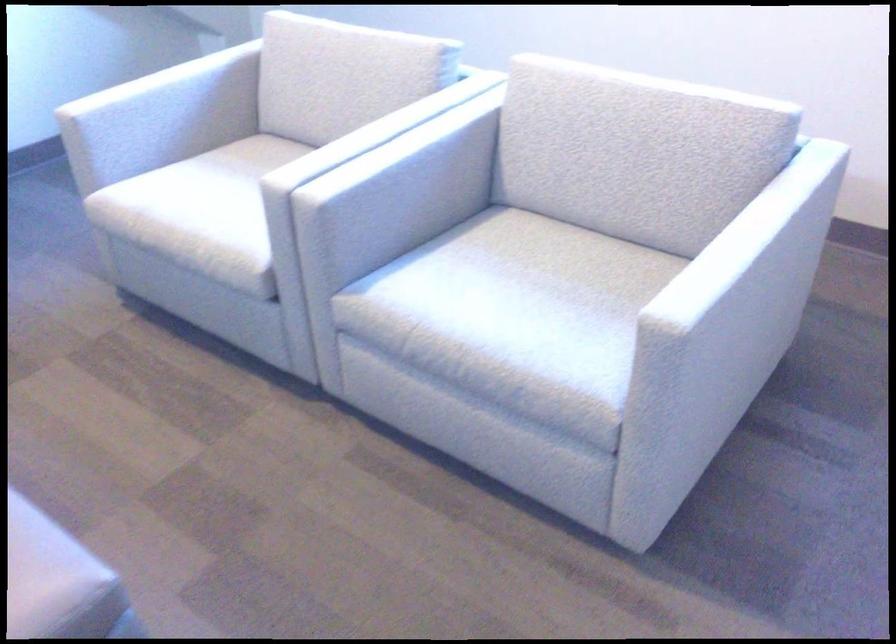
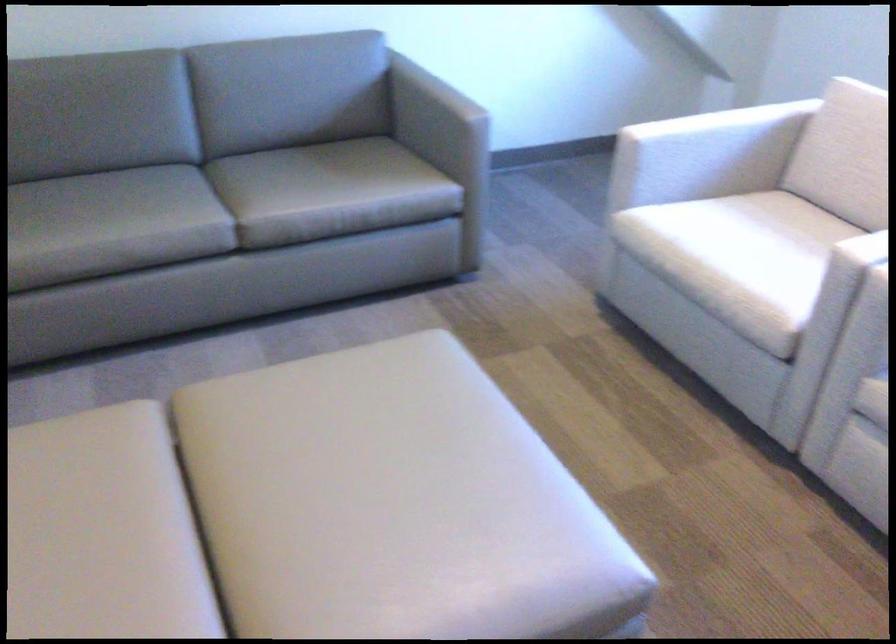
Where in the second image is the point corresponding to point 203,216 from the first image?

(737, 261)